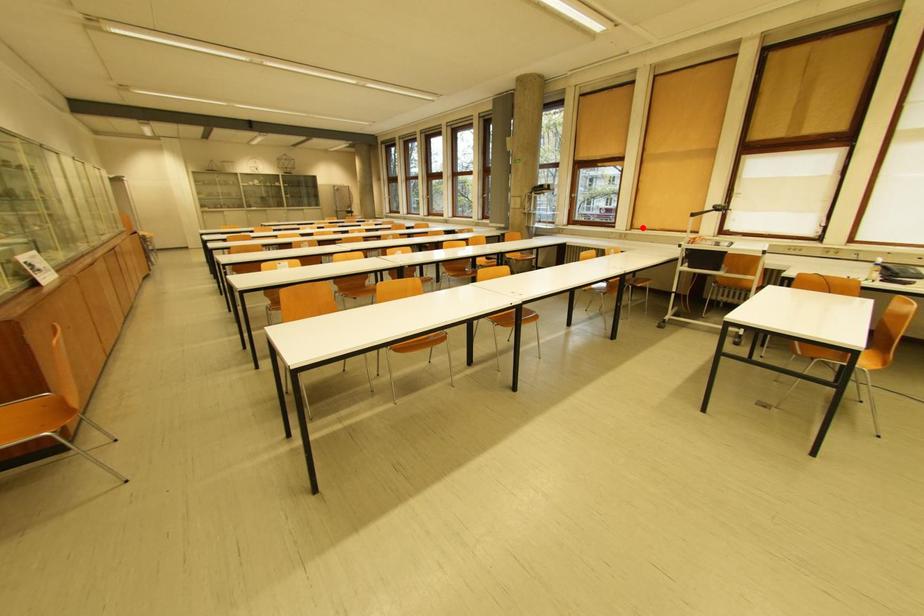
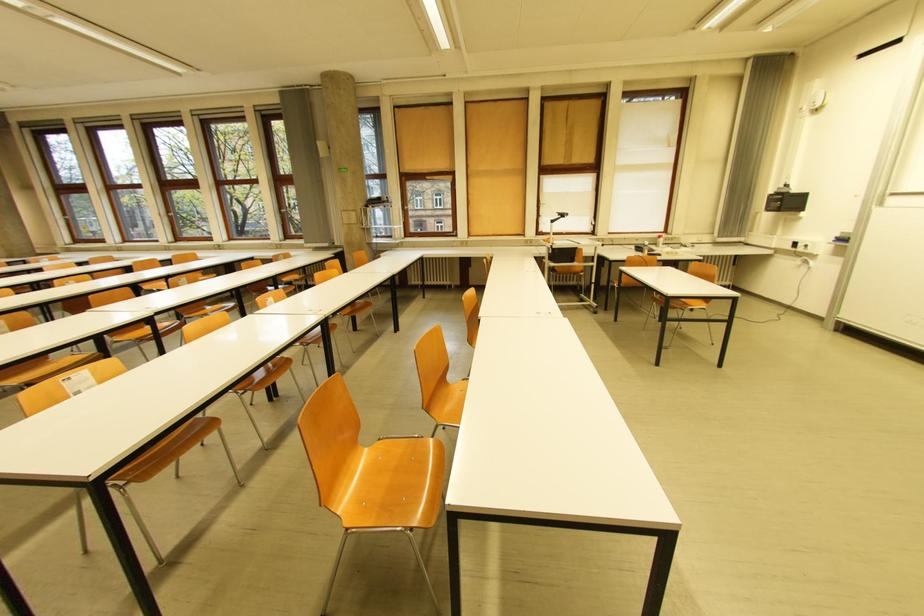
Question: I am providing you with two images of the same scene from different viewpoints. A red point is marked on the first image. At the location where the point appears in image 1, is it still visible in image 2?

Choices:
 (A) Yes
 (B) No

Answer: (A)